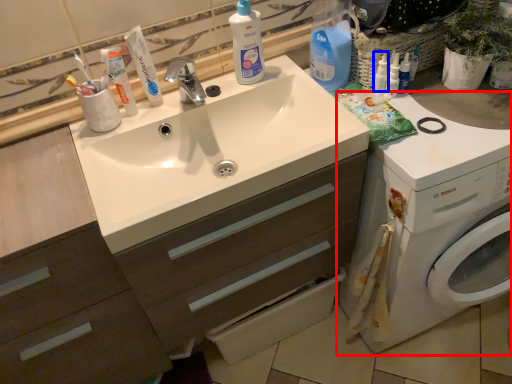
Question: Among these objects, which one is nearest to the camera, washing machine (highlighted by a red box) or cleaning product (highlighted by a blue box)?

Choices:
 (A) washing machine
 (B) cleaning product

Answer: (A)